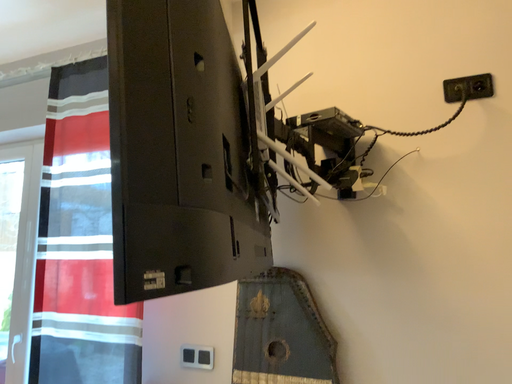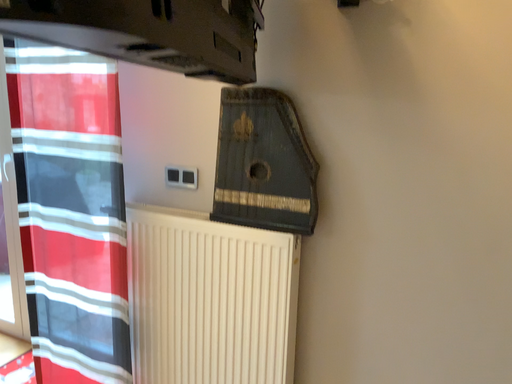
Question: Which way did the camera rotate in the video?

Choices:
 (A) rotated upward
 (B) rotated downward

Answer: (B)